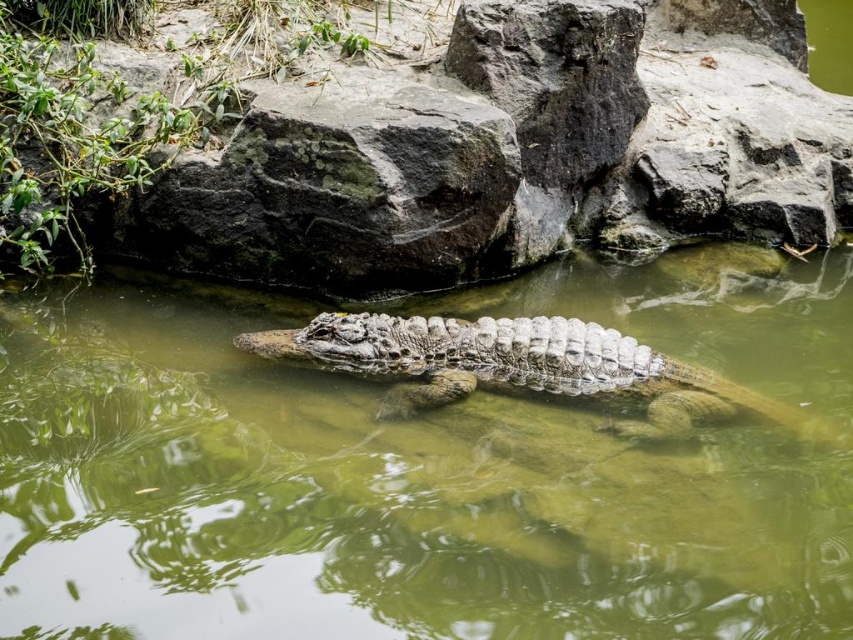
Based on the photo, is greenish murky water at center positioned in front of scaly brown crocodile at center?

Yes, greenish murky water at center is closer to the viewer.

Does greenish murky water at center have a lesser width compared to scaly brown crocodile at center?

No, greenish murky water at center is not thinner than scaly brown crocodile at center.

Is point (440, 612) more distant than point (761, 401)?

No, (440, 612) is in front of (761, 401).

Where is `greenish murky water at center`? This screenshot has height=640, width=853. greenish murky water at center is located at coordinates 373,500.

Between point (844, 97) and point (369, 376), which one is positioned behind?

The point (844, 97) is behind.

Does gray rough rock at center have a greater width compared to scaly brown crocodile at center?

Yes.

The image size is (853, 640). Describe the element at coordinates (506, 152) in the screenshot. I see `gray rough rock at center` at that location.

The image size is (853, 640). Find the location of `gray rough rock at center`. gray rough rock at center is located at coordinates (506, 152).

Is greenish murky water at center wider than gray rough rock at center?

Incorrect, greenish murky water at center's width does not surpass gray rough rock at center's.

Image resolution: width=853 pixels, height=640 pixels. Describe the element at coordinates (373, 500) in the screenshot. I see `greenish murky water at center` at that location.

This screenshot has width=853, height=640. In order to click on greenish murky water at center in this screenshot , I will do `click(373, 500)`.